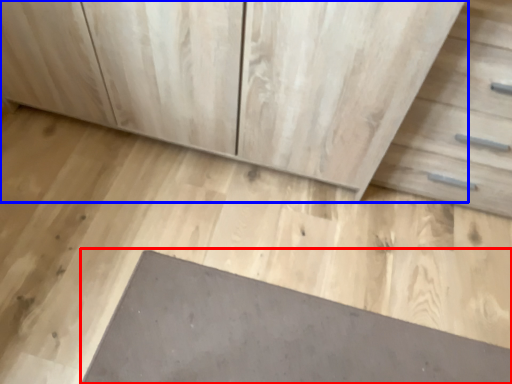
Question: Which object is closer to the camera taking this photo, slate (highlighted by a red box) or chest of drawers (highlighted by a blue box)?

Choices:
 (A) slate
 (B) chest of drawers

Answer: (B)